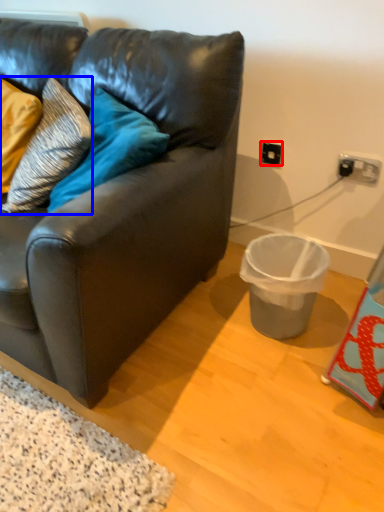
Question: Which object is further to the camera taking this photo, electric outlet (highlighted by a red box) or pillow (highlighted by a blue box)?

Choices:
 (A) electric outlet
 (B) pillow

Answer: (A)